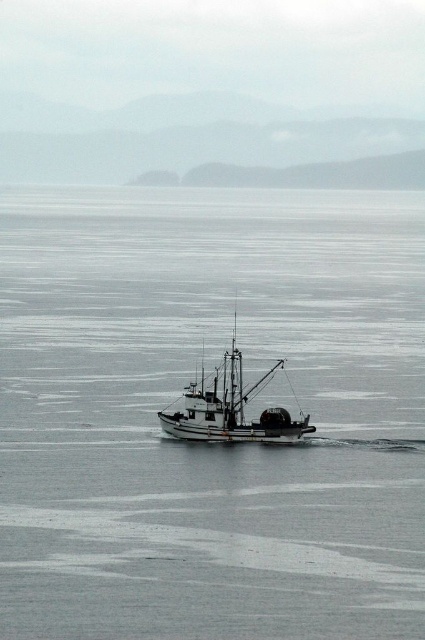
Which is below, gray matte water at center or white matte fishing boat at center?

white matte fishing boat at center is below.

Identify the location of gray matte water at center. Image resolution: width=425 pixels, height=640 pixels. (207, 444).

The height and width of the screenshot is (640, 425). I want to click on gray matte water at center, so click(x=207, y=444).